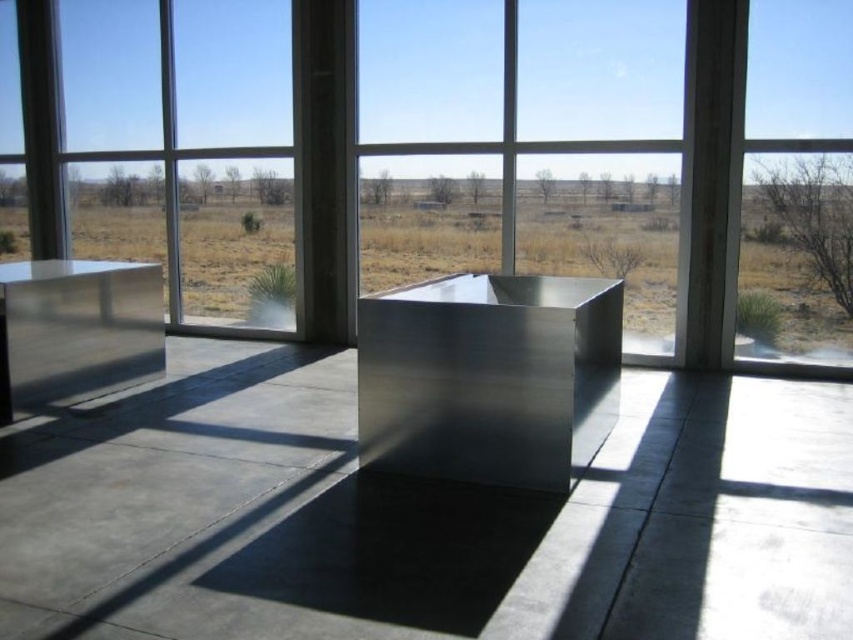
Can you confirm if metallic gray cube at center is positioned to the left of polished metallic box at center?

Indeed, metallic gray cube at center is positioned on the left side of polished metallic box at center.

Can you confirm if metallic gray cube at center is thinner than polished metallic box at center?

No.

Which is in front, point (477, 554) or point (549, 292)?

Point (477, 554) is more forward.

The image size is (853, 640). What are the coordinates of `metallic gray cube at center` in the screenshot? It's located at (421, 516).

Who is more forward, [273,410] or [373,166]?

Point [273,410]

What do you see at coordinates (421, 516) in the screenshot? This screenshot has width=853, height=640. I see `metallic gray cube at center` at bounding box center [421, 516].

Find the location of a particular element. The width and height of the screenshot is (853, 640). metallic gray cube at center is located at coordinates (421, 516).

Who is taller, metallic gray cube at center or clear glass window at right?

clear glass window at right

Which is below, metallic gray cube at center or clear glass window at right?

metallic gray cube at center is below.

Is point (230, 584) more distant than point (798, 300)?

No, it is not.

Locate an element on the screen. The image size is (853, 640). metallic gray cube at center is located at coordinates pos(421,516).